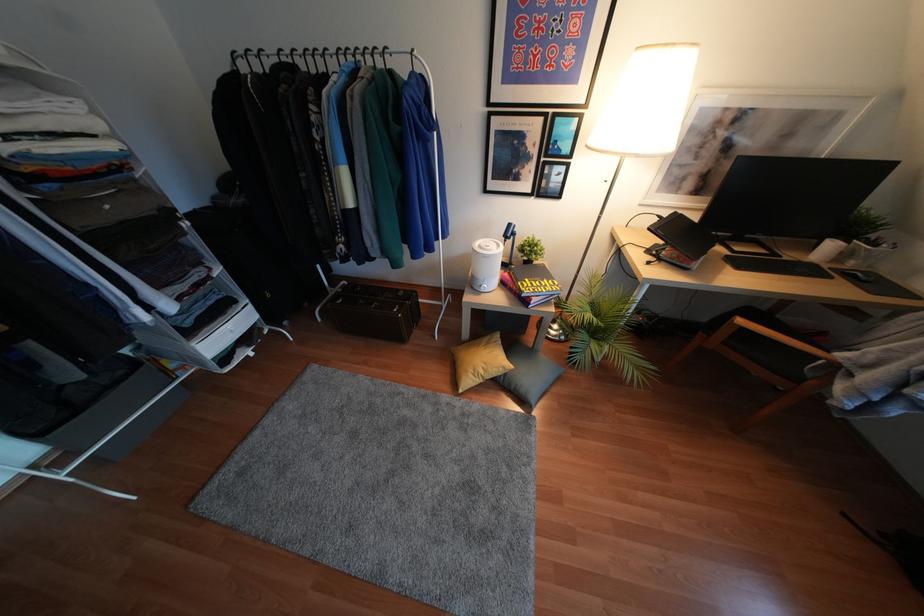
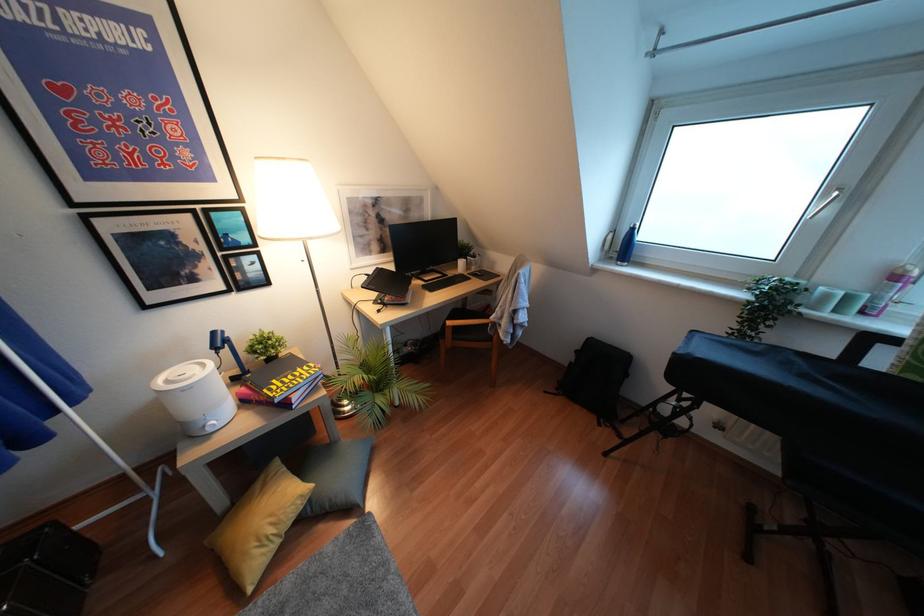
Where in the second image is the point corresponding to pixel 505 374 from the first image?

(310, 500)